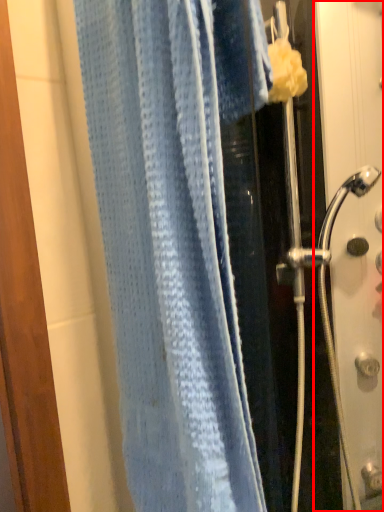
Question: Considering the relative positions of screen door (annotated by the red box) and towel in the image provided, where is screen door (annotated by the red box) located with respect to the staircase?

Choices:
 (A) left
 (B) right

Answer: (B)